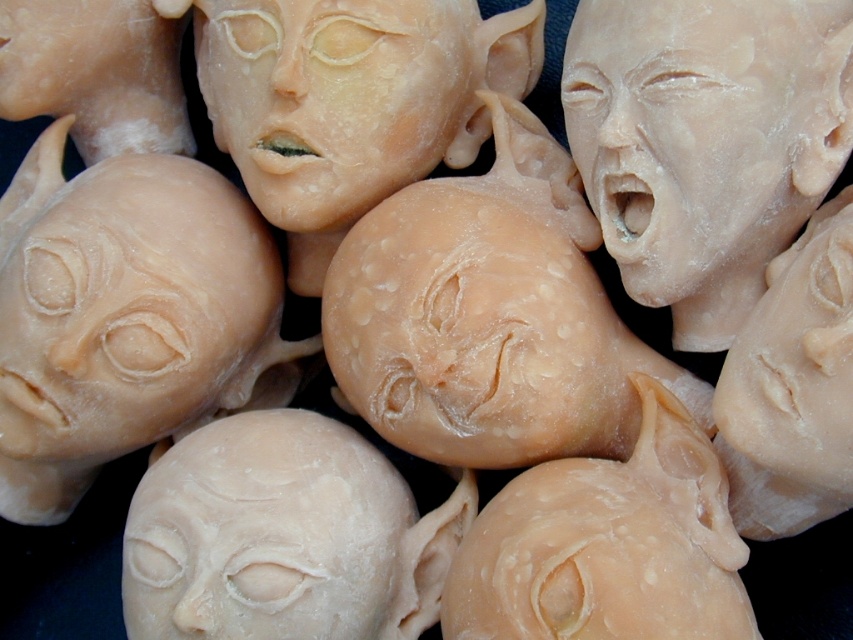
Question: Which object is farther from the camera taking this photo?

Choices:
 (A) matte beige sculpture at upper right
 (B) matte beige sculpture at center

Answer: (B)

Question: Can you confirm if matte beige head at center is wider than matte beige sculpture at center?

Choices:
 (A) yes
 (B) no

Answer: (A)

Question: Among these objects, which one is farthest from the camera?

Choices:
 (A) matte beige sculpture at center
 (B) matte beige head at center

Answer: (A)

Question: Considering the relative positions of matte beige sculpture at upper right and matte beige sculpture at center in the image provided, where is matte beige sculpture at upper right located with respect to matte beige sculpture at center?

Choices:
 (A) above
 (B) below

Answer: (B)

Question: Among these points, which one is farthest from the camera?

Choices:
 (A) (300, 420)
 (B) (268, 36)
 (C) (622, 280)

Answer: (A)

Question: Is matte beige sculpture at upper right positioned in front of matte beige sculpture at center?

Choices:
 (A) yes
 (B) no

Answer: (A)